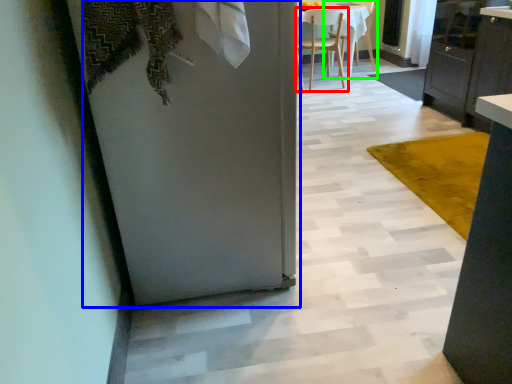
Question: Which is farther away from chair (highlighted by a red box)? door (highlighted by a blue box) or chair (highlighted by a green box)?

Choices:
 (A) door
 (B) chair

Answer: (A)